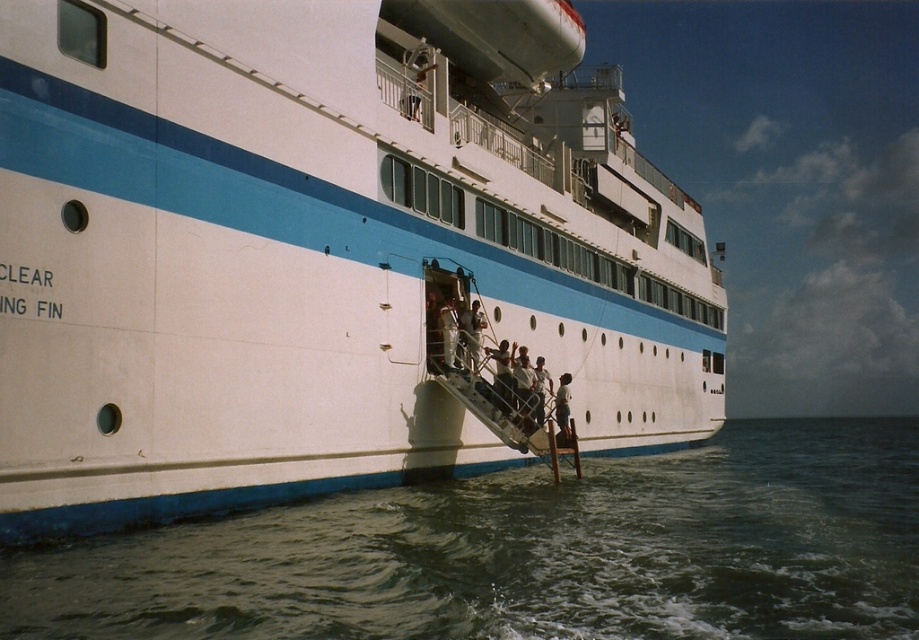
Question: Based on their relative distances, which object is farther from the white glossy ship at center?

Choices:
 (A) greenish water at lower left
 (B) smooth white shirt at lower center

Answer: (B)

Question: From the image, what is the correct spatial relationship of greenish water at lower left in relation to smooth white shirt at lower center?

Choices:
 (A) below
 (B) above

Answer: (A)

Question: Can you confirm if white glossy ship at center is thinner than smooth white shirt at lower center?

Choices:
 (A) no
 (B) yes

Answer: (A)

Question: Based on their relative distances, which object is nearer to the greenish water at lower left?

Choices:
 (A) light blue fabric shirt at lower center
 (B) smooth white shirt at lower center

Answer: (B)

Question: Which point appears farthest from the camera in this image?

Choices:
 (A) pyautogui.click(x=563, y=387)
 (B) pyautogui.click(x=4, y=118)
 (C) pyautogui.click(x=471, y=536)

Answer: (A)

Question: Does white glossy ship at center appear under greenish water at lower left?

Choices:
 (A) yes
 (B) no

Answer: (B)